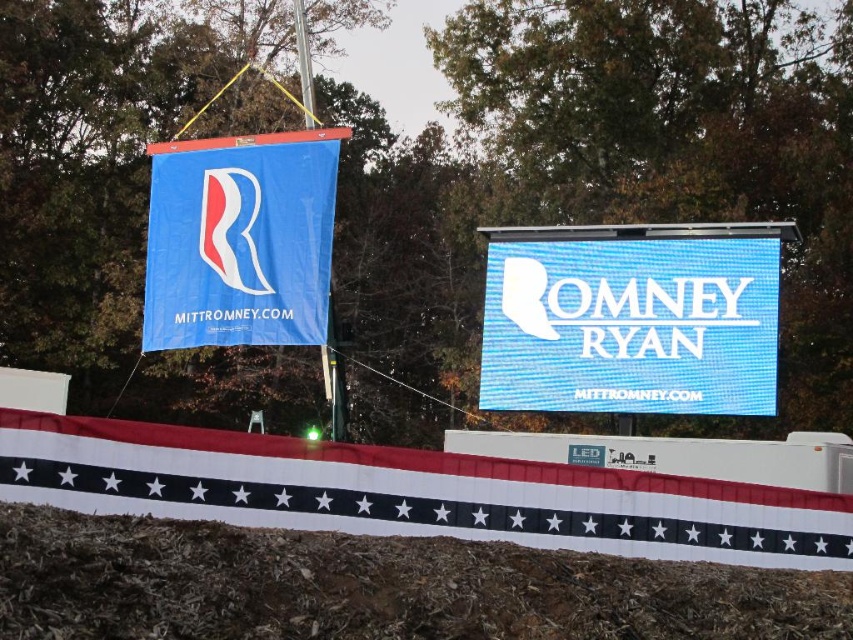
Question: Observing the image, what is the correct spatial positioning of blue mesh sign at center in reference to blue fabric banner at upper left?

Choices:
 (A) above
 (B) below

Answer: (B)

Question: Which of the following is the closest to the observer?

Choices:
 (A) (671, 371)
 (B) (405, 522)

Answer: (B)

Question: Which point is closer to the camera?

Choices:
 (A) (x=271, y=340)
 (B) (x=486, y=276)

Answer: (A)

Question: Does white fabric banner at lower center have a smaller size compared to blue fabric banner at upper left?

Choices:
 (A) no
 (B) yes

Answer: (B)

Question: Does white fabric banner at lower center appear under blue mesh sign at center?

Choices:
 (A) yes
 (B) no

Answer: (A)

Question: Which object is closer to the camera taking this photo?

Choices:
 (A) blue fabric banner at upper left
 (B) blue mesh sign at center
 (C) white fabric banner at lower center

Answer: (C)